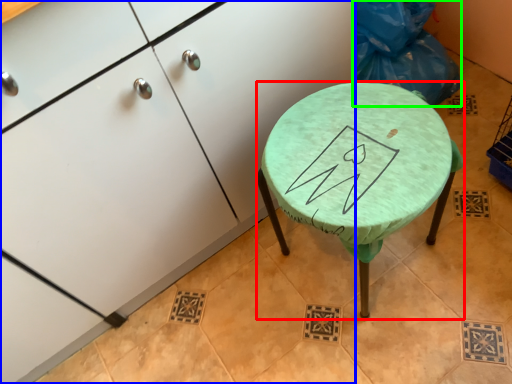
Question: Which is farther away from stool (highlighted by a red box)? cabinetry (highlighted by a blue box) or garbage (highlighted by a green box)?

Choices:
 (A) cabinetry
 (B) garbage

Answer: (B)